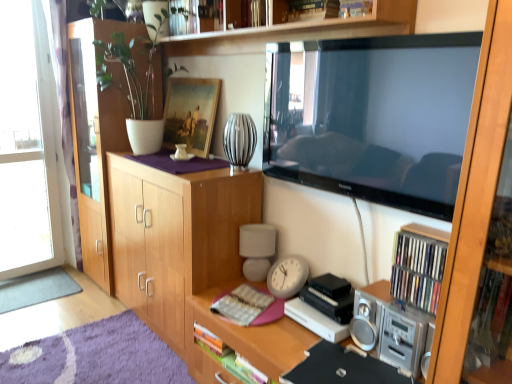
In order to click on free location above silver metallic stereo at lower right (from a real-world perspective) in this screenshot , I will do `click(399, 302)`.